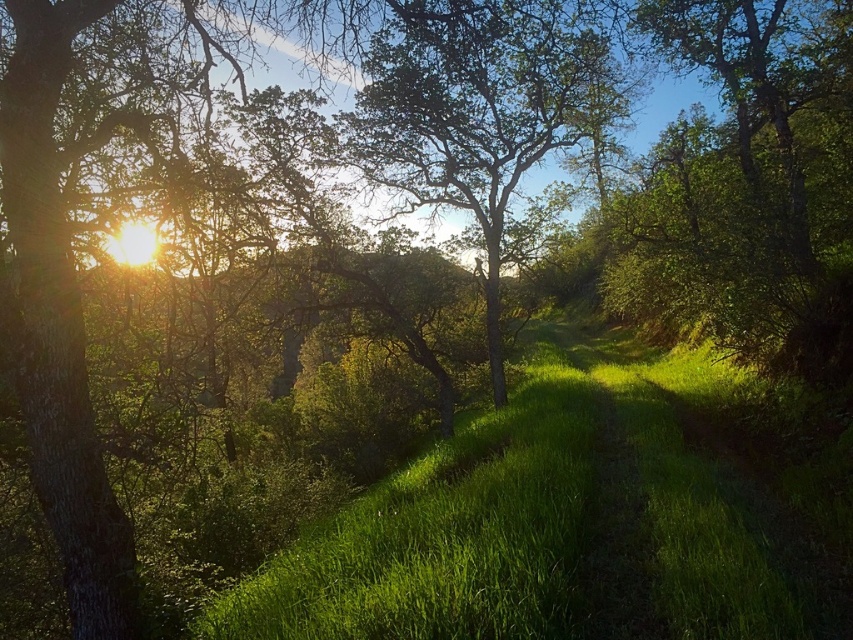
Which is more to the right, green grassy path at center or green leafy tree at center?

green grassy path at center is more to the right.

Does point (717, 529) come farther from viewer compared to point (474, 125)?

No, (717, 529) is closer to viewer.

Locate an element on the screen. The height and width of the screenshot is (640, 853). green grassy path at center is located at coordinates (581, 516).

Image resolution: width=853 pixels, height=640 pixels. Describe the element at coordinates (581, 516) in the screenshot. I see `green grassy path at center` at that location.

Who is taller, green grassy path at center or green grassy trail at center?

Standing taller between the two is green grassy path at center.

Where is `green grassy path at center`? The width and height of the screenshot is (853, 640). green grassy path at center is located at coordinates (581, 516).

From the picture: Which of these two, green leafy tree at center or green grassy trail at center, stands shorter?

green grassy trail at center is shorter.

Which is in front, point (378, 157) or point (592, 525)?

Point (592, 525) is in front.

What do you see at coordinates (476, 109) in the screenshot? I see `green leafy tree at center` at bounding box center [476, 109].

Image resolution: width=853 pixels, height=640 pixels. I want to click on green leafy tree at center, so click(476, 109).